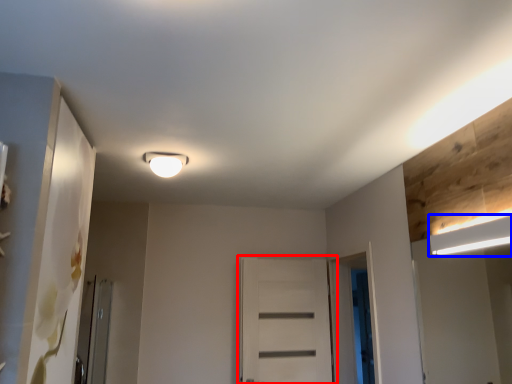
Question: Among these objects, which one is farthest to the camera, door (highlighted by a red box) or lamp (highlighted by a blue box)?

Choices:
 (A) door
 (B) lamp

Answer: (A)